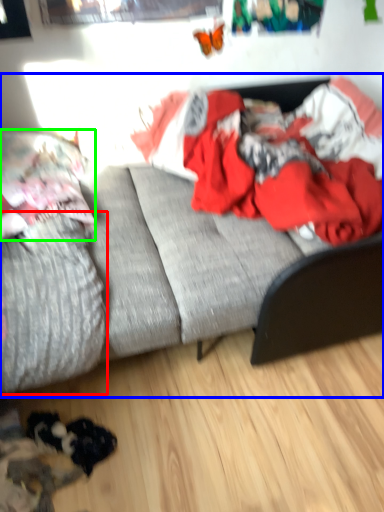
Question: Based on their relative distances, which object is nearer to mattress (highlighted by a red box)? Choose from studio couch (highlighted by a blue box) and pillow (highlighted by a green box).

Choices:
 (A) studio couch
 (B) pillow

Answer: (A)